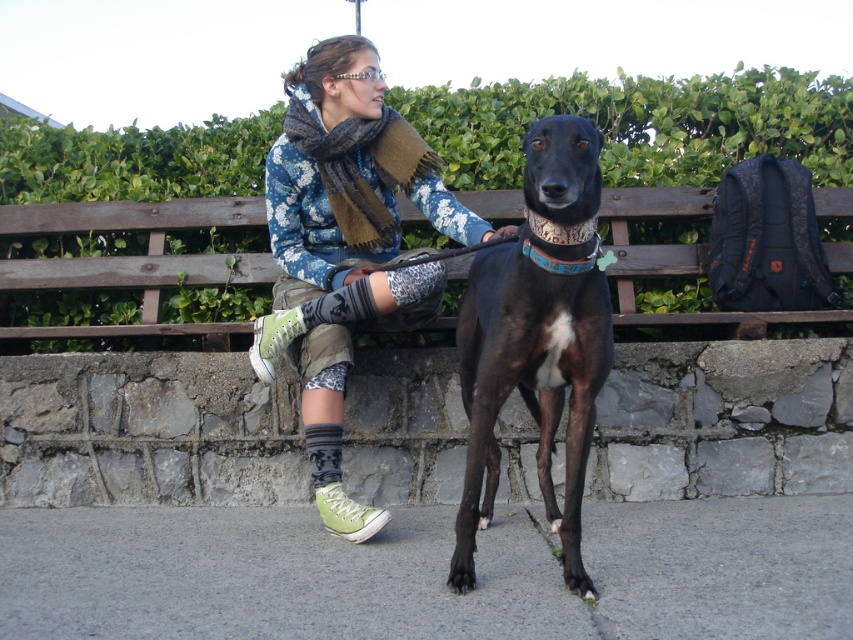
Does gray asphalt pavement at lower center have a greater height compared to floral-patterned sweater at center?

Incorrect, gray asphalt pavement at lower center's height is not larger of floral-patterned sweater at center's.

Is point (283, 621) positioned before point (410, 129)?

Yes, it is in front of point (410, 129).

Which is in front, point (126, 524) or point (271, 352)?

Point (271, 352) is more forward.

The image size is (853, 640). I want to click on gray asphalt pavement at lower center, so click(428, 573).

Can you confirm if black smooth dog at center is bigger than brown woolen scarf at upper center?

Yes.

Who is taller, black smooth dog at center or brown woolen scarf at upper center?

With more height is black smooth dog at center.

Which is behind, point (556, 250) or point (392, 214)?

Positioned behind is point (392, 214).

The width and height of the screenshot is (853, 640). In order to click on black smooth dog at center in this screenshot , I will do `click(537, 337)`.

Between green leafy hedge at upper center and black smooth dog at center, which one is positioned lower?

Positioned lower is black smooth dog at center.

Does green leafy hedge at upper center have a smaller size compared to black smooth dog at center?

Actually, green leafy hedge at upper center might be larger than black smooth dog at center.

Between point (36, 195) and point (465, 292), which one is positioned in front?

Point (465, 292) is more forward.

Image resolution: width=853 pixels, height=640 pixels. What are the coordinates of `green leafy hedge at upper center` in the screenshot? It's located at point(642,124).